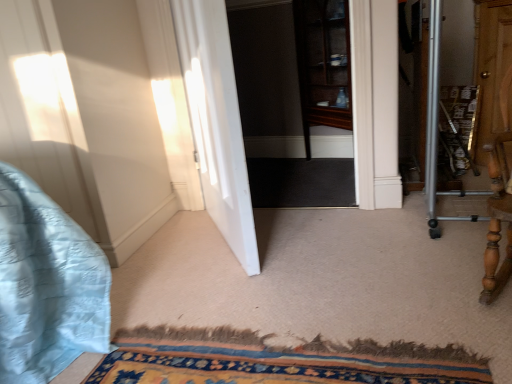
Question: From the image's perspective, is carpeted mat at lower center above or below transparent glass cabinet at center?

Choices:
 (A) below
 (B) above

Answer: (A)

Question: Considering the relative positions of carpeted mat at lower center and transparent glass cabinet at center in the image provided, is carpeted mat at lower center to the left or to the right of transparent glass cabinet at center?

Choices:
 (A) left
 (B) right

Answer: (A)

Question: Estimate the real-world distances between objects in this image. Which object is farther from the white smooth door at center?

Choices:
 (A) carpeted mat at lower center
 (B) transparent glass cabinet at center

Answer: (B)

Question: Which object is positioned farthest from the transparent glass cabinet at center?

Choices:
 (A) carpeted mat at lower center
 (B) white smooth door at center

Answer: (A)